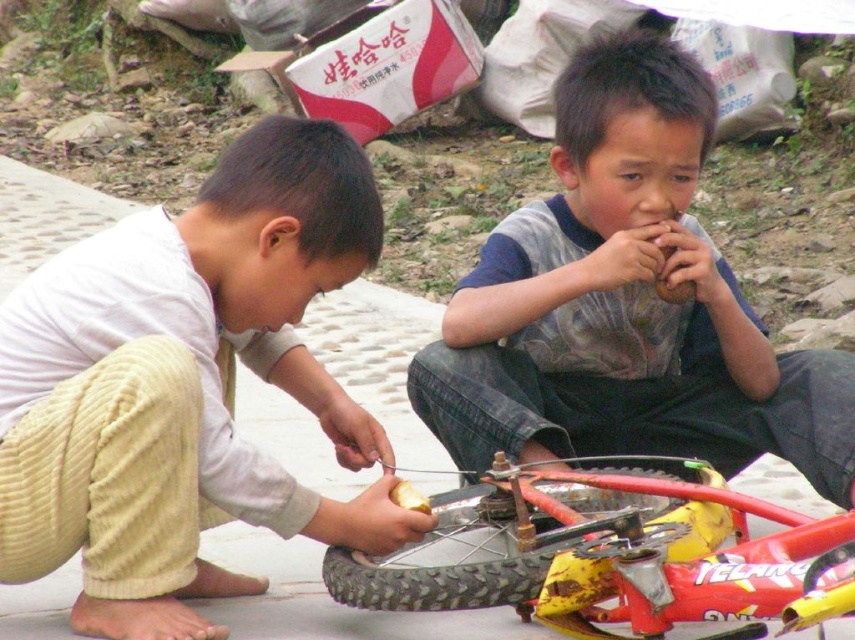
Does point (168, 317) lie in front of point (582, 202)?

Yes, point (168, 317) is in front of point (582, 202).

Who is taller, white matte shirt at lower left or gray cotton shirt at center?

With more height is gray cotton shirt at center.

The height and width of the screenshot is (640, 855). I want to click on white matte shirt at lower left, so click(x=199, y=371).

The height and width of the screenshot is (640, 855). Find the location of `white matte shirt at lower left`. white matte shirt at lower left is located at coordinates click(x=199, y=371).

The image size is (855, 640). What do you see at coordinates (199, 371) in the screenshot?
I see `white matte shirt at lower left` at bounding box center [199, 371].

Image resolution: width=855 pixels, height=640 pixels. Identify the location of white matte shirt at lower left. (199, 371).

Which is behind, point (398, 515) or point (649, 509)?

Point (649, 509)

Image resolution: width=855 pixels, height=640 pixels. What are the coordinates of `white matte shirt at lower left` in the screenshot? It's located at (199, 371).

Is point (620, 262) farther from camera compared to point (466, 490)?

No, it is not.

Is gray cotton shirt at center to the left of yellow rubber tire at lower center from the viewer's perspective?

In fact, gray cotton shirt at center is to the right of yellow rubber tire at lower center.

Between point (840, 394) and point (453, 580), which one is positioned behind?

Positioned behind is point (840, 394).

You are a GUI agent. You are given a task and a screenshot of the screen. Output one action in this format:
    pyautogui.click(x=<x>, y=<y>)
    Task: Click on the gray cotton shirt at center
    This screenshot has height=640, width=855.
    Given the screenshot: What is the action you would take?
    pyautogui.click(x=624, y=304)